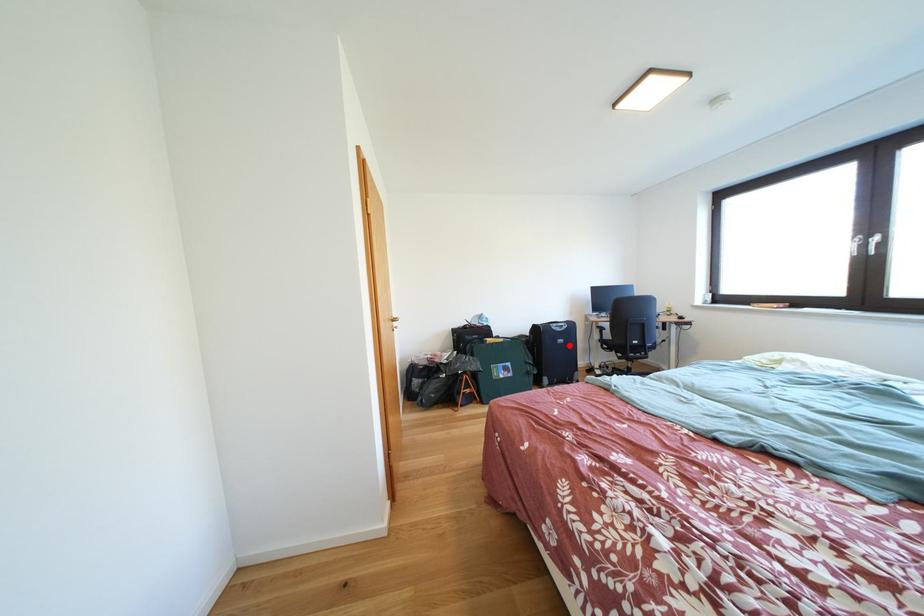
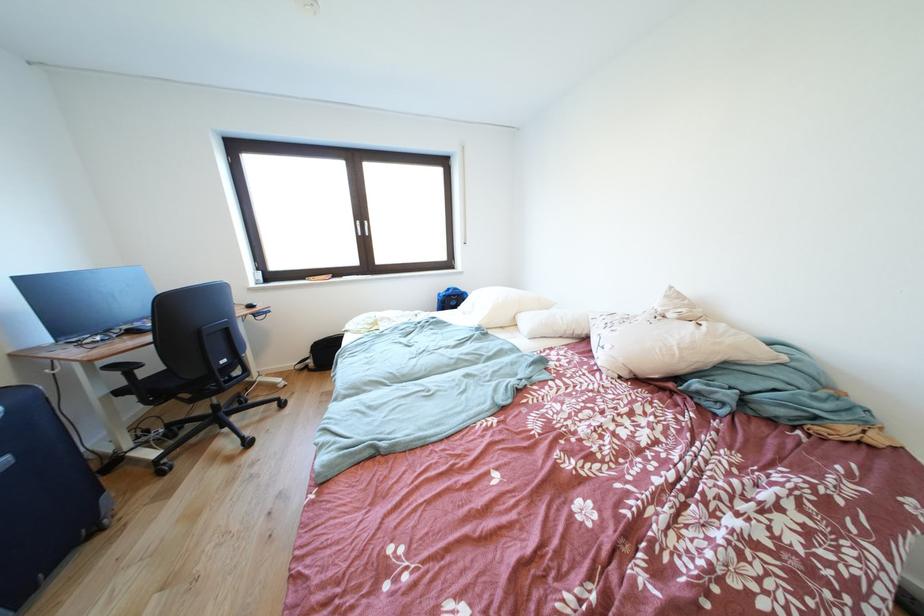
The point at the highlighted location is marked in the first image. Where is the corresponding point in the second image?

(8, 468)